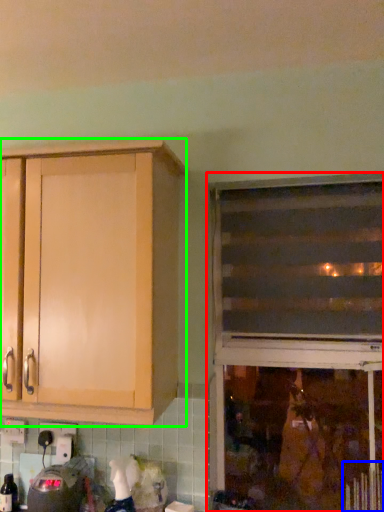
Question: Which is farther away from window (highlighted by a red box)? radiator (highlighted by a blue box) or cabinetry (highlighted by a green box)?

Choices:
 (A) radiator
 (B) cabinetry

Answer: (B)